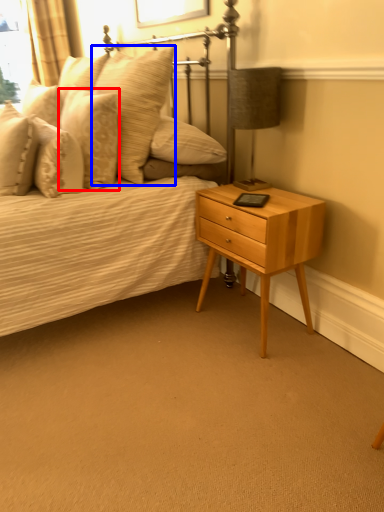
Question: Which point is closer to the camera, pillow (highlighted by a red box) or pillow (highlighted by a blue box)?

Choices:
 (A) pillow
 (B) pillow

Answer: (B)